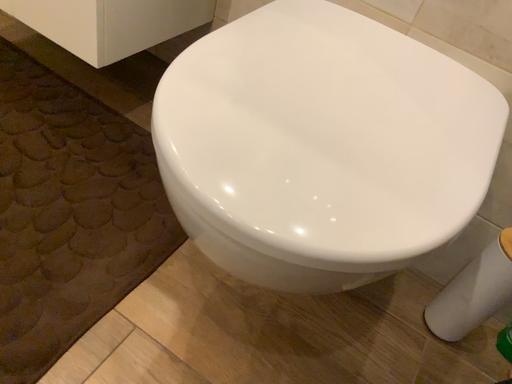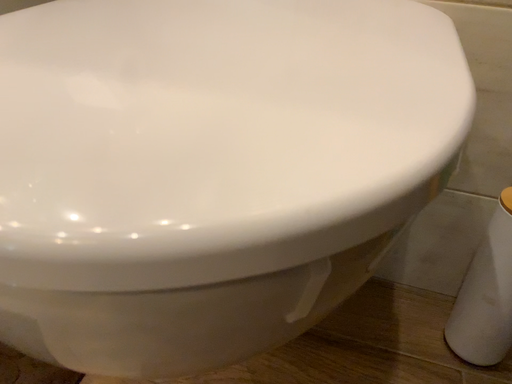
Question: How did the camera likely rotate when shooting the video?

Choices:
 (A) rotated downward
 (B) rotated upward

Answer: (B)